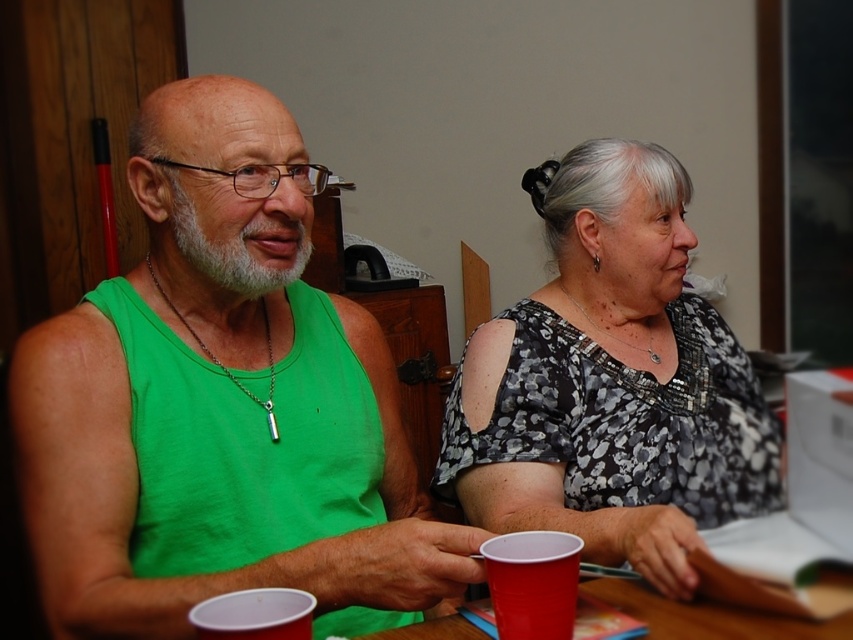
You are organizing a small party and need to place a decorative centerpiece on the table. Considering the size of the smooth wooden table at center and the matte plastic cup at lower center, will the table have enough space to accommodate the centerpiece without displacing the cup?

The smooth wooden table at center is larger in size than the matte plastic cup at lower center, so there is sufficient space to place a decorative centerpiece on the table without displacing the cup.